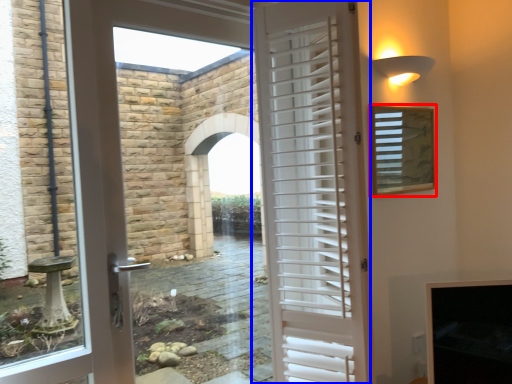
Question: Among these objects, which one is nearest to the camera, window screen (highlighted by a red box) or door (highlighted by a blue box)?

Choices:
 (A) window screen
 (B) door

Answer: (B)